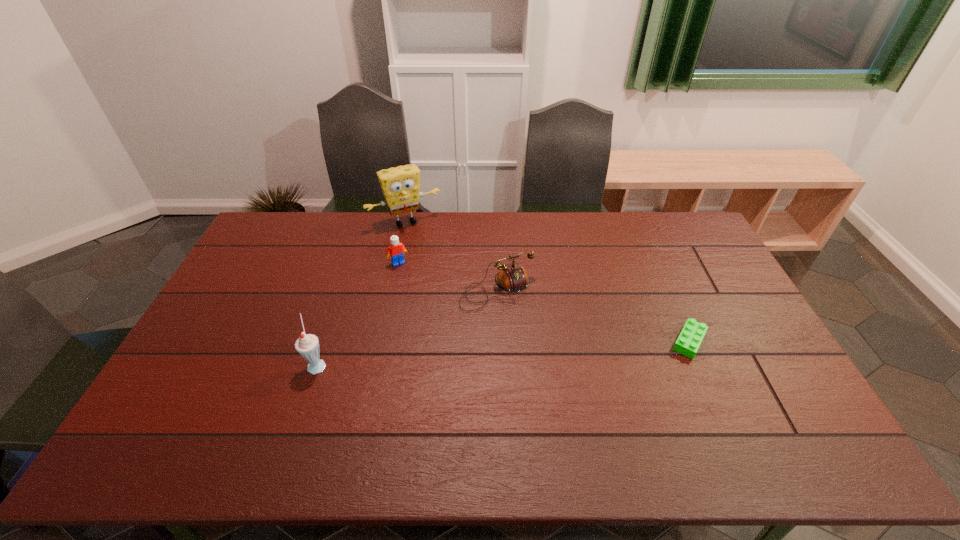
Locate an element on the screen. This screenshot has width=960, height=540. vacant space on the desktop that is between the milkshake and the rightmost object and is positioned on the face of the farthest object is located at coordinates (477, 354).

This screenshot has width=960, height=540. What are the coordinates of `free space on the desktop that is between the milkshake and the shorter Lego and is positioned on the rotary dial of the second object from right to left` in the screenshot? It's located at click(x=538, y=350).

Where is `vacant spot on the desktop that is between the fourth shortest object and the shortest object and is positioned on the face of the fourth nearest object`? This screenshot has height=540, width=960. vacant spot on the desktop that is between the fourth shortest object and the shortest object and is positioned on the face of the fourth nearest object is located at coordinates (451, 356).